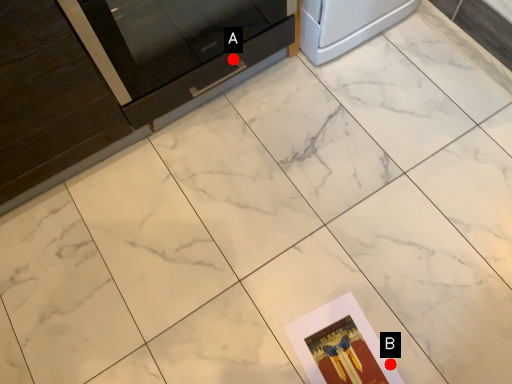
Question: Two points are circled on the image, labeled by A and B beside each circle. Which point appears farthest from the camera in this image?

Choices:
 (A) A is further
 (B) B is further

Answer: (A)